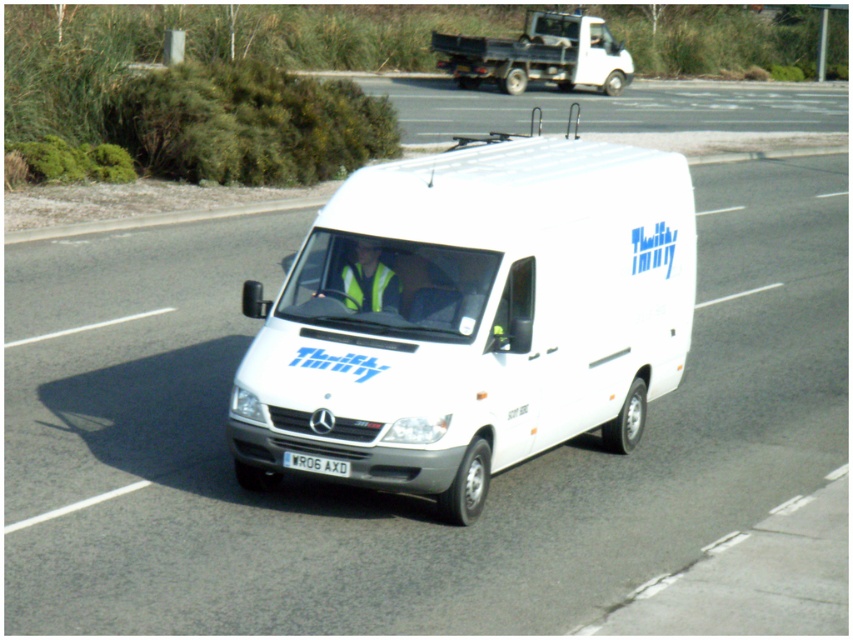
Question: Which of these objects is positioned closest to the white plastic license plate at center?

Choices:
 (A) white matte van at center
 (B) white matte truck at upper center

Answer: (A)

Question: Which point is farther to the camera?

Choices:
 (A) white matte truck at upper center
 (B) white matte van at center
 (C) white plastic license plate at center

Answer: (A)

Question: In this image, where is white matte van at center located relative to white matte truck at upper center?

Choices:
 (A) above
 (B) below

Answer: (B)

Question: Is white matte truck at upper center to the left of white plastic license plate at center from the viewer's perspective?

Choices:
 (A) yes
 (B) no

Answer: (B)

Question: Considering the relative positions of white matte van at center and white plastic license plate at center in the image provided, where is white matte van at center located with respect to white plastic license plate at center?

Choices:
 (A) above
 (B) below

Answer: (A)

Question: Which of the following is the farthest from the observer?

Choices:
 (A) (320, 468)
 (B) (589, 36)

Answer: (B)